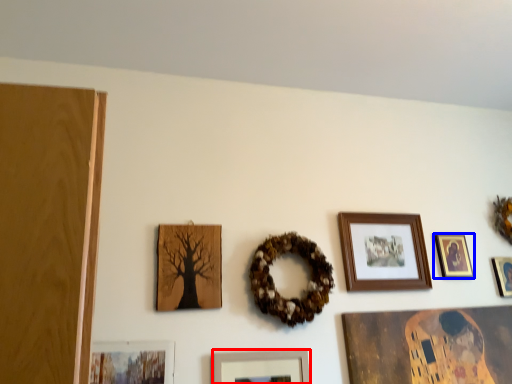
Question: Which point is further to the camera, picture frame (highlighted by a red box) or picture frame (highlighted by a blue box)?

Choices:
 (A) picture frame
 (B) picture frame

Answer: (B)